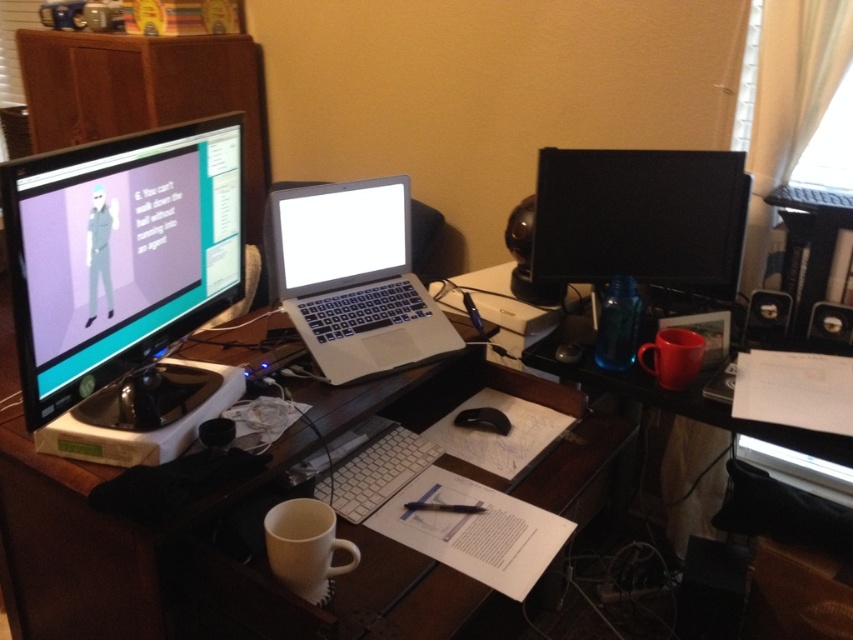
Question: Which object is the closest to the white glossy desk at center?

Choices:
 (A) metallic silver speaker at upper right
 (B) black glossy monitor at upper right
 (C) black plastic speaker at right
 (D) silver metallic laptop at center

Answer: (D)

Question: Which point is closer to the camera?

Choices:
 (A) (833, 349)
 (B) (544, 272)

Answer: (A)

Question: Does matte black monitor at left lie behind black plastic speaker at right?

Choices:
 (A) no
 (B) yes

Answer: (A)

Question: Which object appears closest to the camera in this image?

Choices:
 (A) white glossy laptop at center
 (B) black plastic speaker at right
 (C) metallic silver speaker at upper right
 (D) white glossy desk at center

Answer: (D)

Question: Is white glossy desk at center smaller than silver metallic laptop at center?

Choices:
 (A) yes
 (B) no

Answer: (B)

Question: Is matte black monitor at left to the left of silver metallic laptop at center from the viewer's perspective?

Choices:
 (A) no
 (B) yes

Answer: (B)